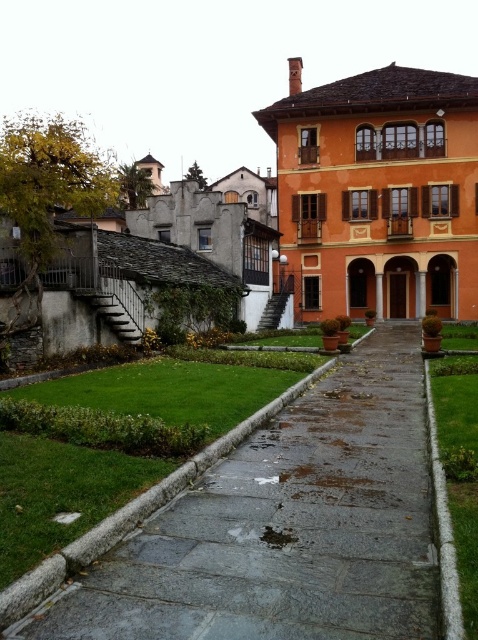
You are a tourist walking towards the orange building in the courtyard. You want to reach the front door, which is behind the gray concrete path at center. Which direction should you walk relative to the green grass at center?

You should walk towards the gray concrete path at center, which is in front of the green grass at center, so you need to move forward past the gray concrete path at center to reach the front door behind it.

You are standing in the courtyard and want to walk to the building without getting your shoes dirty. Which surface should you choose between the gray concrete path at center and the green grass at center?

The gray concrete path at center is located below green grass at center, so the green grass at center is higher. Walking on the green grass at center may keep your shoes cleaner as it is higher and possibly drier compared to the wet gray concrete path at center.

You are standing at point (442, 378) and want to walk to the orange building in the courtyard. Which direction should you move relative to point (194, 580)?

You should move towards point (194, 580) because it is in front of point (442, 378), so moving towards it will lead you closer to the orange building.